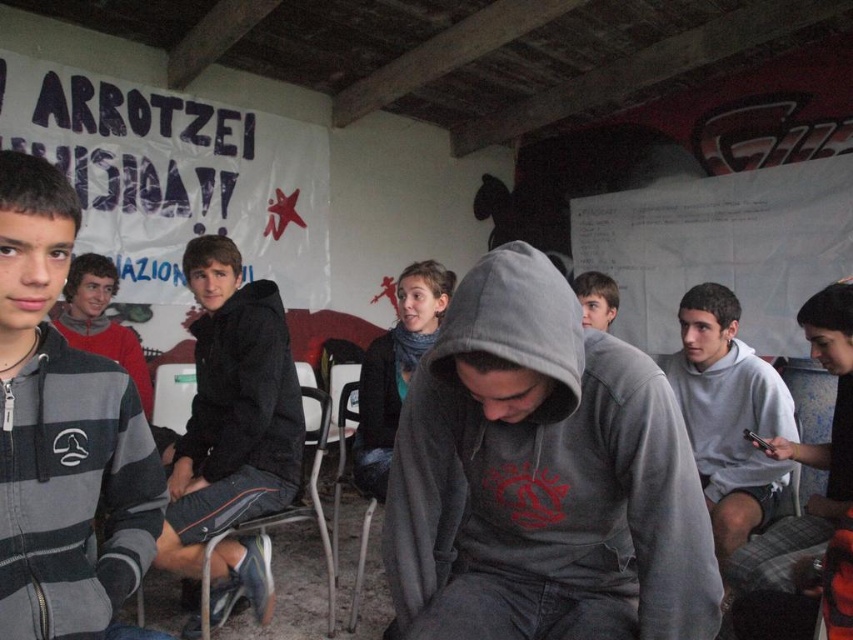
Who is positioned more to the left, black matte jacket at center or black matte sweatshirt at center?

black matte jacket at center

Who is higher up, black matte jacket at center or black matte sweatshirt at center?

black matte sweatshirt at center is higher up.

Where is `black matte jacket at center`? black matte jacket at center is located at coordinates (231, 410).

Image resolution: width=853 pixels, height=640 pixels. Find the location of `black matte jacket at center`. black matte jacket at center is located at coordinates (231, 410).

This screenshot has width=853, height=640. In order to click on gray matte hoodie at center in this screenshot , I will do [x=543, y=476].

From the picture: Can you confirm if gray matte hoodie at center is shorter than black matte jacket at center?

Correct, gray matte hoodie at center is not as tall as black matte jacket at center.

This screenshot has width=853, height=640. What are the coordinates of `gray matte hoodie at center` in the screenshot? It's located at (543, 476).

Between black matte jacket at center and gray hoodie at right, which one appears on the left side from the viewer's perspective?

black matte jacket at center

Can you confirm if black matte jacket at center is positioned to the right of gray hoodie at right?

No, black matte jacket at center is not to the right of gray hoodie at right.

Describe the element at coordinates (231, 410) in the screenshot. The image size is (853, 640). I see `black matte jacket at center` at that location.

Locate an element on the screen. black matte jacket at center is located at coordinates (231, 410).